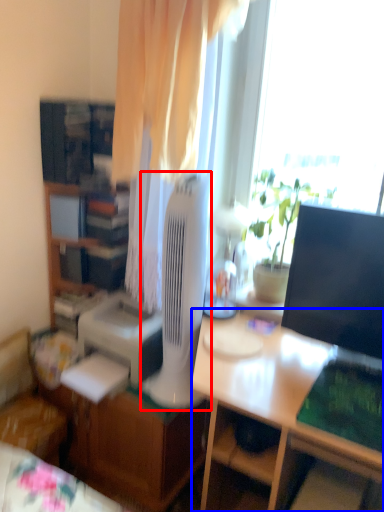
Question: Which object appears farthest to the camera in this image, mechanical fan (highlighted by a red box) or desk (highlighted by a blue box)?

Choices:
 (A) mechanical fan
 (B) desk

Answer: (A)